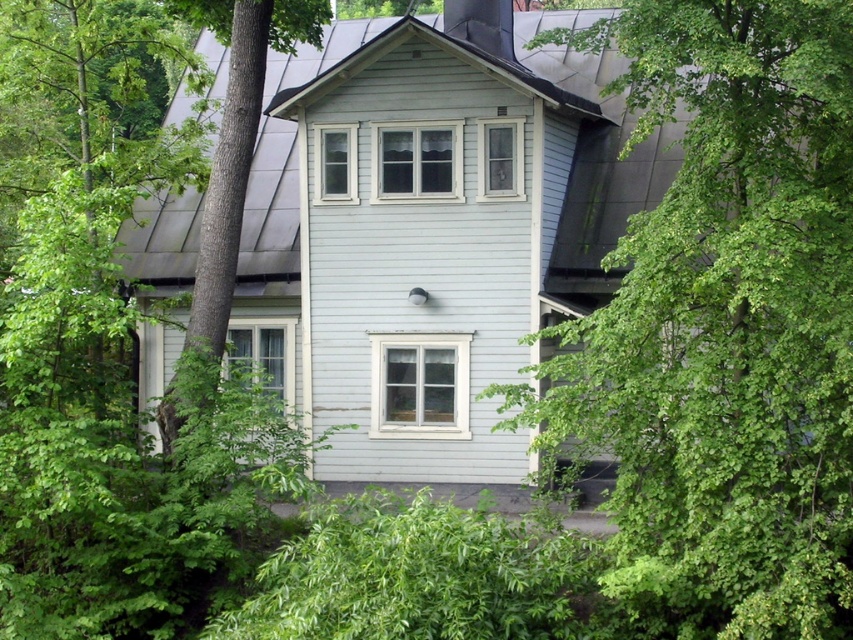
Does green leafy tree at center have a lesser width compared to green leafy tree at left?

No.

From the picture: Does green leafy tree at center have a lesser height compared to green leafy tree at left?

No.

Who is more forward, [656,64] or [247,131]?

Positioned in front is point [656,64].

Identify the location of green leafy tree at center. (724, 326).